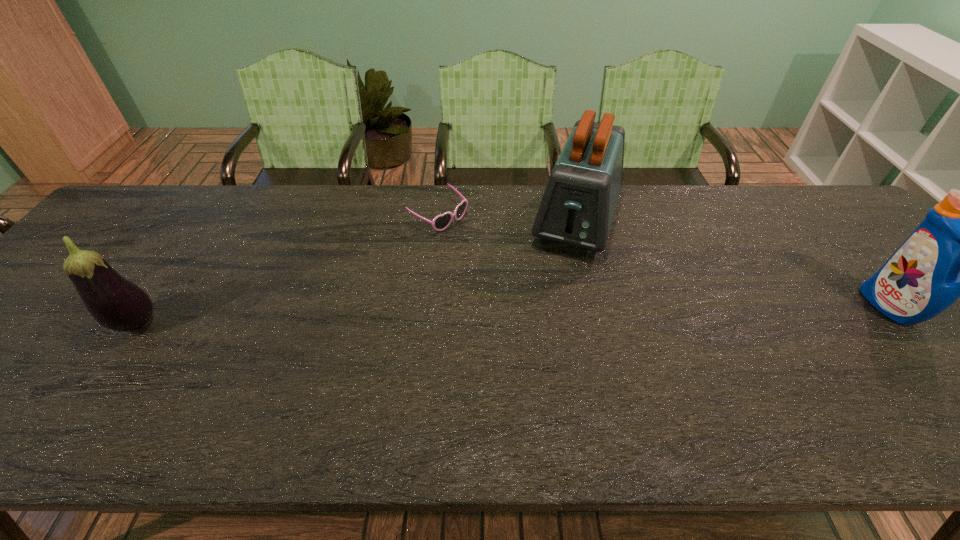
Locate an element on the screen. This screenshot has height=540, width=960. free space on the desktop that is between the leftmost object and the detergent and is positioned on the front-facing side of the shortest object is located at coordinates (592, 314).

Identify the location of free space on the desktop that is between the eggplant and the rightmost object and is positioned on the front-facing side of the toaster. Image resolution: width=960 pixels, height=540 pixels. (542, 315).